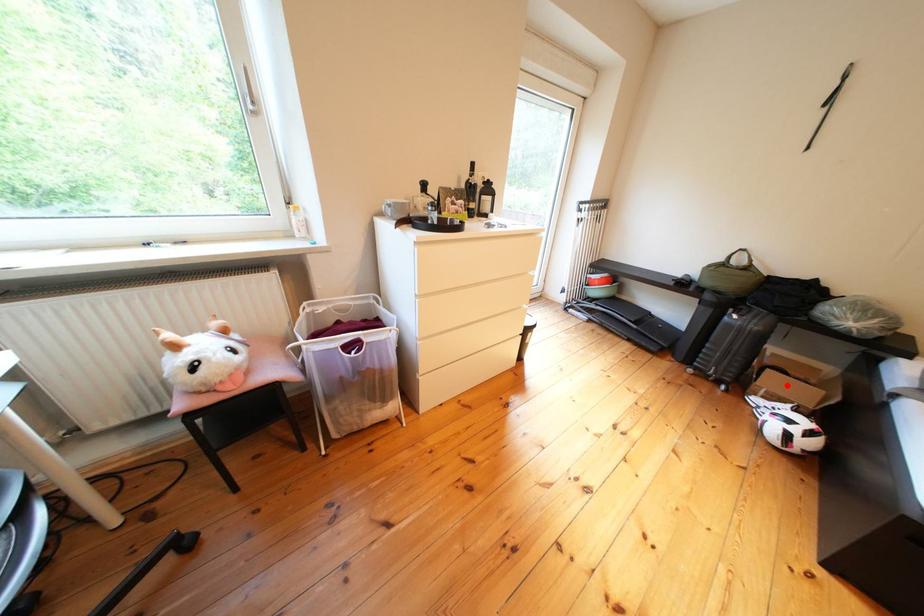
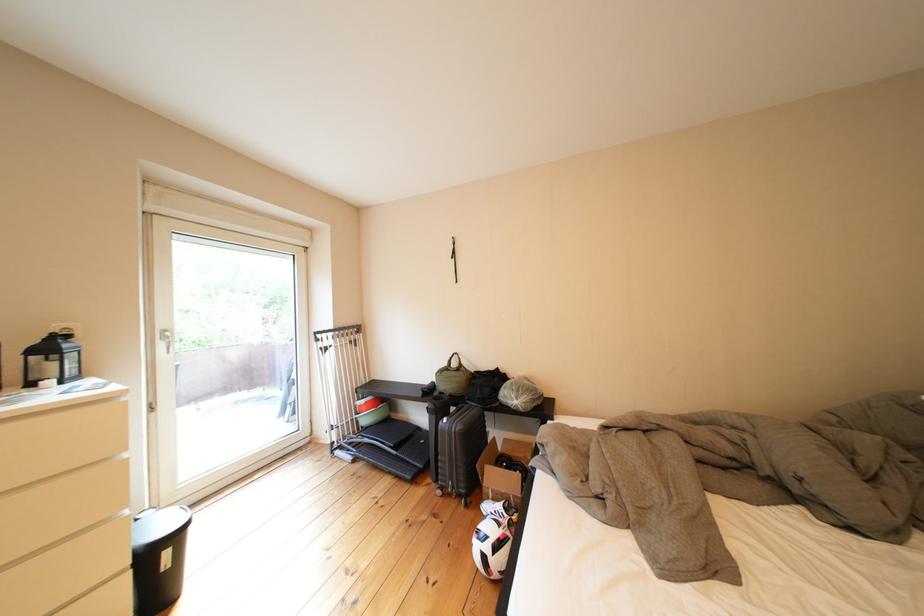
Question: I am providing you with two images of the same scene from different viewpoints. In image1, a red point is highlighted. Considering the same 3D point in image2, which of the following is correct?

Choices:
 (A) It is closer
 (B) It is farther

Answer: (A)